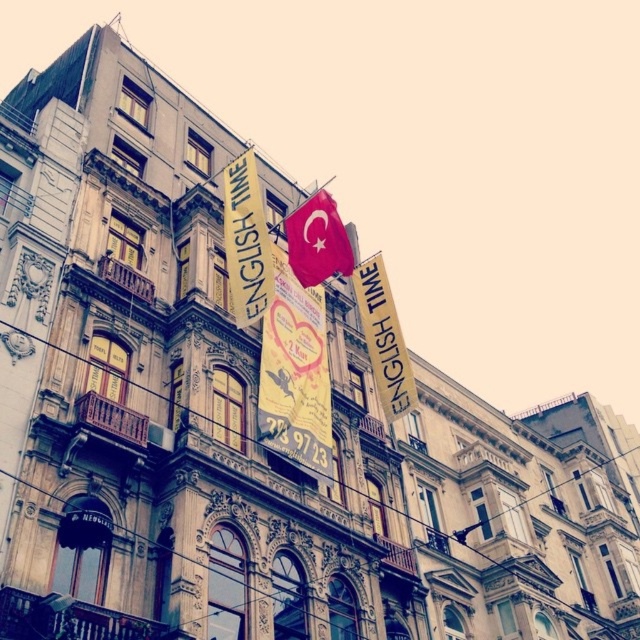
Question: Estimate the real-world distances between objects in this image. Which object is closer to the yellow fabric sign at upper center?

Choices:
 (A) red fabric flag at center
 (B) yellow paper banner at upper center

Answer: (A)

Question: Does yellow paper banner at upper center have a lesser width compared to red fabric flag at center?

Choices:
 (A) no
 (B) yes

Answer: (B)

Question: Among these objects, which one is farthest from the camera?

Choices:
 (A) yellow fabric sign at upper center
 (B) yellow paper banner at upper center

Answer: (B)

Question: Which point is farther to the camera?

Choices:
 (A) (x=268, y=268)
 (B) (x=317, y=273)
 (C) (x=380, y=253)

Answer: (C)

Question: Can you confirm if yellow paper banner at upper center is positioned to the right of red fabric flag at center?

Choices:
 (A) yes
 (B) no

Answer: (A)

Question: Is yellow fabric sign at upper center further to camera compared to red fabric flag at center?

Choices:
 (A) yes
 (B) no

Answer: (B)